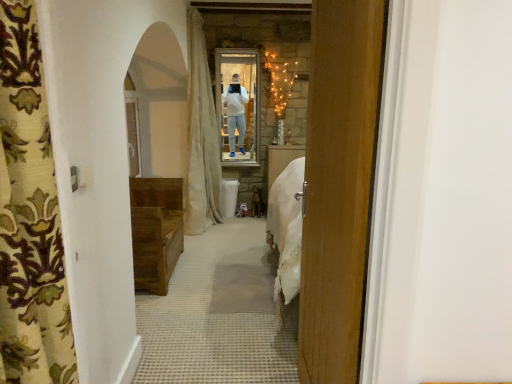
The image size is (512, 384). In order to click on white fabric curtain at center, the 2th curtain viewed from the front in this screenshot , I will do `click(201, 137)`.

The width and height of the screenshot is (512, 384). I want to click on white fabric curtain at center, placed as the first curtain when sorted from back to front, so click(x=201, y=137).

Between patterned fabric curtain at left, acting as the 2th curtain starting from the back, and wooden chest at left, which one has larger size?

wooden chest at left.

Which object is positioned more to the right, patterned fabric curtain at left, acting as the 2th curtain starting from the back, or wooden chest at left?

patterned fabric curtain at left, acting as the 2th curtain starting from the back.

Is the surface of patterned fabric curtain at left, acting as the 2th curtain starting from the back, in direct contact with wooden chest at left?

patterned fabric curtain at left, acting as the 2th curtain starting from the back, and wooden chest at left are clearly separated.

Does patterned fabric curtain at left, the first curtain viewed from the front, contain wooden chest at left?

No, wooden chest at left is located outside of patterned fabric curtain at left, the first curtain viewed from the front.

Which of these two, wooden door at center or wooden chest at left, is bigger?

wooden chest at left.

Considering their positions, is wooden door at center located in front of or behind wooden chest at left?

Clearly, wooden door at center is in front of wooden chest at left.

Considering the points (305, 261) and (147, 273), which point is in front, point (305, 261) or point (147, 273)?

The point (305, 261) is closer to the camera.

Considering the relative positions of wooden door at center and patterned fabric curtain at left, the first curtain viewed from the front, in the image provided, is wooden door at center behind patterned fabric curtain at left, the first curtain viewed from the front,?

Yes, it is.

From a real-world perspective, is wooden door at center under patterned fabric curtain at left, the first curtain viewed from the front?

Indeed, from a real-world perspective, wooden door at center is positioned beneath patterned fabric curtain at left, the first curtain viewed from the front.

From the image's perspective, between wooden door at center and patterned fabric curtain at left, acting as the 2th curtain starting from the back, which one is located above?

patterned fabric curtain at left, acting as the 2th curtain starting from the back.

You are a GUI agent. You are given a task and a screenshot of the screen. Output one action in this format:
    pyautogui.click(x=<x>, y=<y>)
    Task: Click on the 1st curtain counting from the left of the wooden door at center
    The image size is (512, 384).
    Given the screenshot: What is the action you would take?
    pyautogui.click(x=29, y=216)

Is point (257, 139) farther from viewer compared to point (319, 368)?

Yes, point (257, 139) is farther from viewer.

Considering the relative sizes of matte glass mirror at center and wooden door at center in the image provided, is matte glass mirror at center shorter than wooden door at center?

Yes, matte glass mirror at center is shorter than wooden door at center.

Considering their positions, is matte glass mirror at center located in front of or behind wooden door at center?

In the image, matte glass mirror at center appears behind wooden door at center.

Is matte glass mirror at center touching white fabric curtain at center, the 2th curtain viewed from the front?

They are not placed beside each other.

How much distance is there between matte glass mirror at center and white fabric curtain at center, placed as the first curtain when sorted from back to front?

They are 50.82 centimeters apart.

Is white fabric curtain at center, placed as the first curtain when sorted from back to front, completely or partially inside matte glass mirror at center?

No, white fabric curtain at center, placed as the first curtain when sorted from back to front, is located outside of matte glass mirror at center.

Considering the relative positions of matte glass mirror at center and white fabric curtain at center, the 2th curtain viewed from the front, in the image provided, is matte glass mirror at center in front of white fabric curtain at center, the 2th curtain viewed from the front,?

No, it is behind white fabric curtain at center, the 2th curtain viewed from the front.

From the image's perspective, is white fabric curtain at center, placed as the first curtain when sorted from back to front, located beneath wooden chest at left?

No.

Is wooden chest at left at the back of white fabric curtain at center, the 2th curtain viewed from the front?

white fabric curtain at center, the 2th curtain viewed from the front, is not turned away from wooden chest at left.

Is white fabric curtain at center, placed as the first curtain when sorted from back to front, positioned before wooden chest at left?

That is False.

Are wooden chest at left and wooden door at center located far from each other?

Yes.

Is wooden chest at left oriented away from wooden door at center?

wooden chest at left is not turned away from wooden door at center.

Is wooden chest at left outside of wooden door at center?

wooden chest at left lies outside wooden door at center's area.

Based on the photo, does wooden chest at left have a greater height compared to wooden door at center?

Incorrect, the height of wooden chest at left is not larger of that of wooden door at center.

From the image's perspective, starting from the wooden chest at left, which curtain is the 1st one above? Please provide its 2D coordinates.

[(29, 216)]

You are a GUI agent. You are given a task and a screenshot of the screen. Output one action in this format:
    pyautogui.click(x=<x>, y=<y>)
    Task: Click on the door in front of the wooden chest at left
    
    Given the screenshot: What is the action you would take?
    pyautogui.click(x=339, y=185)

Estimate the real-world distances between objects in this image. Which object is further from wooden chest at left, wooden door at center or matte glass mirror at center?

wooden door at center.

Looking at the image, which one is located further to matte glass mirror at center, wooden door at center or wooden chest at left?

wooden door at center is further to matte glass mirror at center.

From the image, which object appears to be nearer to matte glass mirror at center, patterned fabric curtain at left, acting as the 2th curtain starting from the back, or white fabric curtain at center, the 2th curtain viewed from the front?

Among the two, white fabric curtain at center, the 2th curtain viewed from the front, is located nearer to matte glass mirror at center.

Which object lies nearer to the anchor point wooden chest at left, matte glass mirror at center or wooden door at center?

The object closer to wooden chest at left is matte glass mirror at center.

Which object lies further to the anchor point matte glass mirror at center, wooden door at center or white fabric curtain at center, the 2th curtain viewed from the front?

wooden door at center is positioned further to the anchor matte glass mirror at center.

Which object lies nearer to the anchor point white fabric curtain at center, placed as the first curtain when sorted from back to front, patterned fabric curtain at left, the first curtain viewed from the front, or wooden door at center?

wooden door at center.

Looking at this image, from the image, which object appears to be farther from wooden door at center, wooden chest at left or patterned fabric curtain at left, the first curtain viewed from the front?

wooden chest at left lies further to wooden door at center than the other object.

From the image, which object appears to be nearer to wooden chest at left, wooden door at center or white fabric curtain at center, placed as the first curtain when sorted from back to front?

Among the two, white fabric curtain at center, placed as the first curtain when sorted from back to front, is located nearer to wooden chest at left.

You are a GUI agent. You are given a task and a screenshot of the screen. Output one action in this format:
    pyautogui.click(x=<x>, y=<y>)
    Task: Click on the furniture between wooden door at center and white fabric curtain at center, the 2th curtain viewed from the front, from front to back
    Image resolution: width=512 pixels, height=384 pixels.
    Given the screenshot: What is the action you would take?
    pyautogui.click(x=156, y=231)

Locate an element on the screen. This screenshot has width=512, height=384. door between patterned fabric curtain at left, the first curtain viewed from the front, and white fabric curtain at center, placed as the first curtain when sorted from back to front, along the z-axis is located at coordinates (339, 185).

Identify the location of curtain positioned between patterned fabric curtain at left, acting as the 2th curtain starting from the back, and matte glass mirror at center from near to far. (201, 137).

Identify the location of door between patterned fabric curtain at left, acting as the 2th curtain starting from the back, and matte glass mirror at center from front to back. (339, 185).